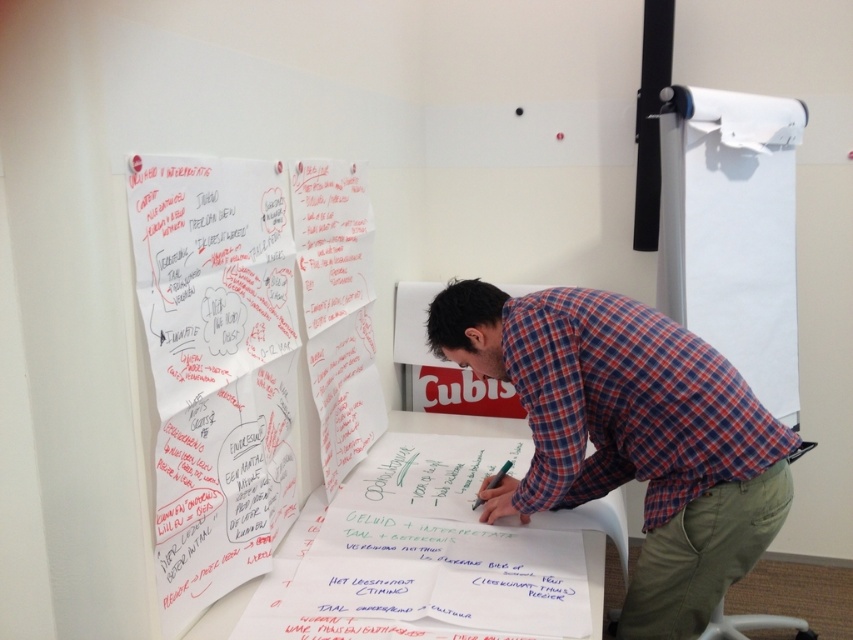
Can you confirm if plaid shirt at center is positioned to the left of green matte pen at center?

In fact, plaid shirt at center is to the right of green matte pen at center.

Is plaid shirt at center smaller than green matte pen at center?

No.

Image resolution: width=853 pixels, height=640 pixels. What are the coordinates of `plaid shirt at center` in the screenshot? It's located at (630, 436).

I want to click on plaid shirt at center, so click(630, 436).

Who is more forward, (x=251, y=410) or (x=506, y=419)?

Positioned in front is point (x=251, y=410).

Is the position of white paper at upper left less distant than that of white paper at center?

Yes, white paper at upper left is closer to the viewer.

Is point (300, 237) positioned before point (486, 426)?

Yes, it is.

Where is `white paper at upper left`? The height and width of the screenshot is (640, 853). white paper at upper left is located at coordinates (242, 353).

What are the coordinates of `plaid shirt at center` in the screenshot? It's located at (630, 436).

Does plaid shirt at center lie behind white paper at center?

No.

Is point (596, 317) farther from viewer compared to point (387, 424)?

That is False.

Where is `plaid shirt at center`? The image size is (853, 640). plaid shirt at center is located at coordinates (630, 436).